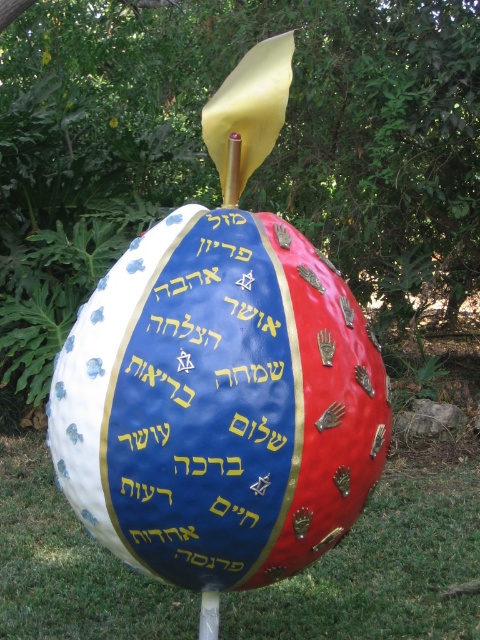
Question: Is gold metallic hebrew words at center to the right of green grass at center from the viewer's perspective?

Choices:
 (A) yes
 (B) no

Answer: (A)

Question: Based on their relative distances, which object is nearer to the metallic silver pole at center?

Choices:
 (A) green grass at center
 (B) glossy metallic sphere at center

Answer: (B)

Question: Among these objects, which one is nearest to the camera?

Choices:
 (A) gold metallic hebrew words at center
 (B) metallic silver pole at center
 (C) green grass at center

Answer: (A)

Question: Does glossy metallic sphere at center appear over gold metallic hebrew words at center?

Choices:
 (A) no
 (B) yes

Answer: (B)

Question: Which of these objects is positioned farthest from the metallic silver pole at center?

Choices:
 (A) green grass at center
 (B) glossy metallic sphere at center
 (C) gold metallic hebrew words at center

Answer: (A)

Question: Is glossy metallic sphere at center positioned behind green grass at center?

Choices:
 (A) no
 (B) yes

Answer: (A)